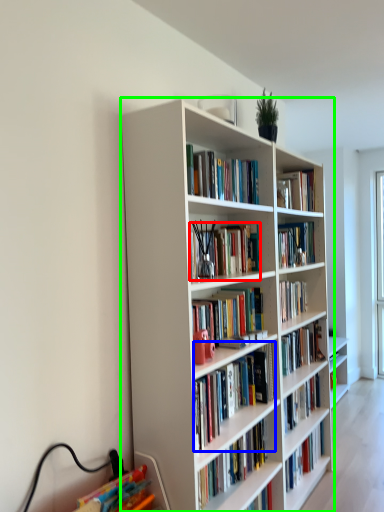
Question: Estimate the real-world distances between objects in this image. Which object is closer to book (highlighted by a red box), book (highlighted by a blue box) or bookcase (highlighted by a green box)?

Choices:
 (A) book
 (B) bookcase

Answer: (B)